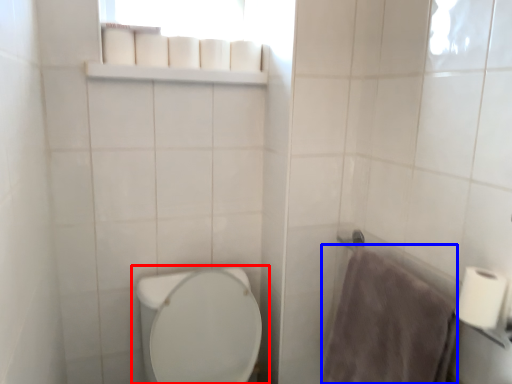
Question: Which object is closer to the camera taking this photo, toilet (highlighted by a red box) or bath towel (highlighted by a blue box)?

Choices:
 (A) toilet
 (B) bath towel

Answer: (A)